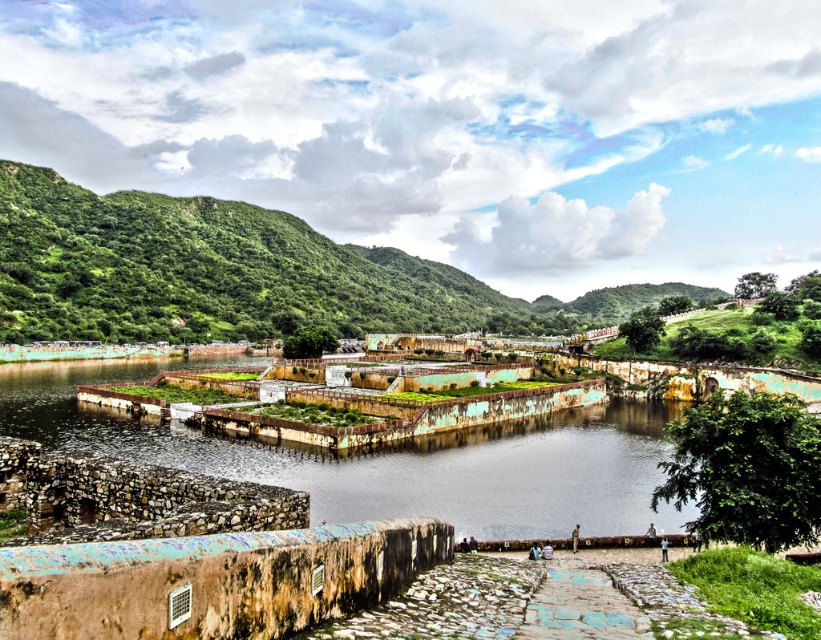
Question: Can you confirm if green leafy hillside at upper left is smaller than brown stone river at center?

Choices:
 (A) yes
 (B) no

Answer: (B)

Question: Among these points, which one is farthest from the camera?

Choices:
 (A) (447, 316)
 (B) (122, 364)

Answer: (A)

Question: Is green leafy hillside at upper left above brown stone river at center?

Choices:
 (A) yes
 (B) no

Answer: (A)

Question: Does green leafy hillside at upper left have a larger size compared to brown stone river at center?

Choices:
 (A) no
 (B) yes

Answer: (B)